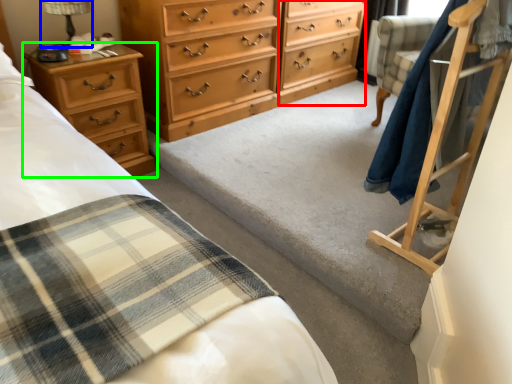
Question: Which object is positioned closest to file cabinet (highlighted by a red box)? Select from table lamp (highlighted by a blue box) and chest of drawers (highlighted by a green box).

Choices:
 (A) table lamp
 (B) chest of drawers

Answer: (B)